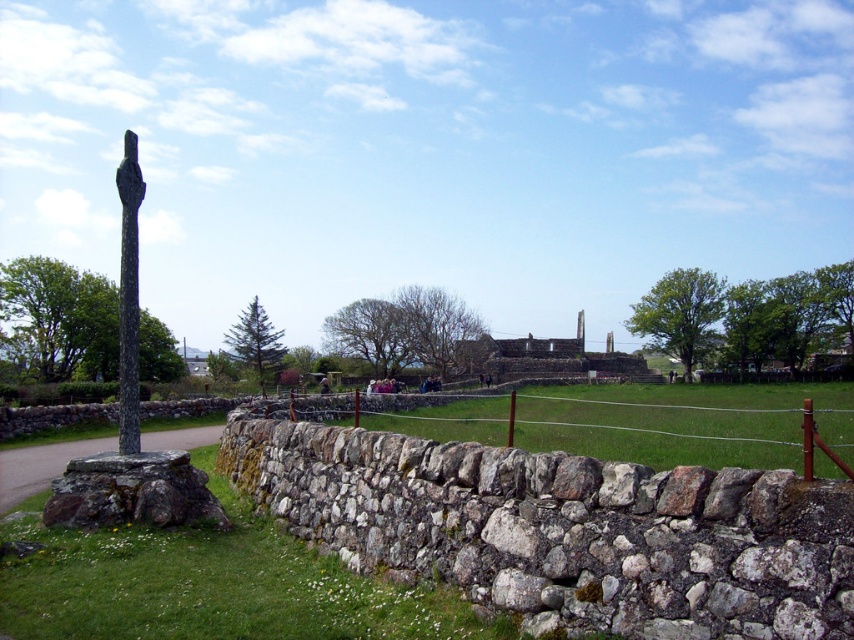
You are a landscape architect designing a pathway between the natural stone wall at center and the green grass at lower left. The pathway must be 4 meters long. Can you fit the pathway between them without overlapping either structure?

The natural stone wall at center is 4.19 meters away from the green grass at lower left. Since the required pathway length is 4 meters, which is shorter than the distance between them, the pathway can be placed between them without overlapping either structure.

You are a landscape architect designing a pathway that needs to pass between the natural stone wall at center and the dark gray stone pole at left. Considering their heights, which structure would require adjustments to ensure the pathway remains accessible for visitors?

The natural stone wall at center has a lesser height compared to the dark gray stone pole at left, so the pathway would need to be adjusted around the taller dark gray stone pole at left to maintain accessibility.

You are standing in front of the historical stone cross monument and want to place a small flag at each of the two points marked in the image. The first point is at coordinates point (578, 531) and the second at point (455, 625). Which point is closer to you when you are facing the monument?

Point (578, 531) is closer to the camera than point (455, 625), so when facing the monument, the first point at point (578, 531) is closer to you.